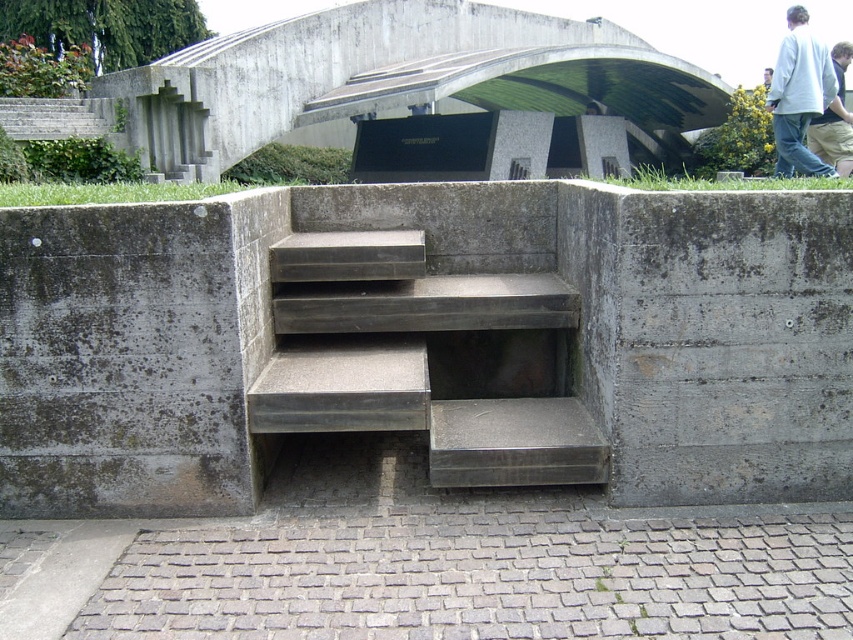
Who is lower down, gray concrete stairs at center or white cotton shirt at upper right?

Positioned lower is gray concrete stairs at center.

Is gray concrete stairs at center to the right of white cotton shirt at upper right from the viewer's perspective?

In fact, gray concrete stairs at center is to the left of white cotton shirt at upper right.

You are a GUI agent. You are given a task and a screenshot of the screen. Output one action in this format:
    pyautogui.click(x=<x>, y=<y>)
    Task: Click on the gray concrete stairs at center
    Image resolution: width=853 pixels, height=640 pixels.
    Given the screenshot: What is the action you would take?
    pyautogui.click(x=427, y=358)

How much distance is there between white cotton shirt at upper right and light blue jeans at upper right?

They are 11.57 meters apart.

Is point (773, 93) closer to viewer compared to point (846, 150)?

Yes, point (773, 93) is in front of point (846, 150).

The image size is (853, 640). What do you see at coordinates (799, 96) in the screenshot?
I see `white cotton shirt at upper right` at bounding box center [799, 96].

The width and height of the screenshot is (853, 640). I want to click on white cotton shirt at upper right, so click(x=799, y=96).

Is gray concrete stairs at center below light blue jeans at upper right?

Correct, gray concrete stairs at center is located below light blue jeans at upper right.

Is gray concrete stairs at center to the left of light blue jeans at upper right from the viewer's perspective?

Yes, gray concrete stairs at center is to the left of light blue jeans at upper right.

Where is `gray concrete stairs at center`? This screenshot has height=640, width=853. gray concrete stairs at center is located at coordinates (427, 358).

Where is `gray concrete stairs at center`? gray concrete stairs at center is located at coordinates pyautogui.click(x=427, y=358).